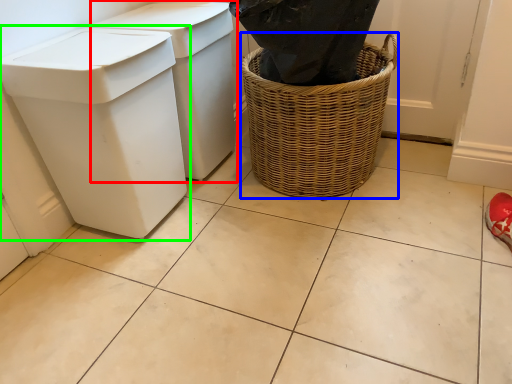
Question: Which is nearer to the waste container (highlighted by a red box)? basket container (highlighted by a blue box) or waste container (highlighted by a green box).

Choices:
 (A) basket container
 (B) waste container

Answer: (B)